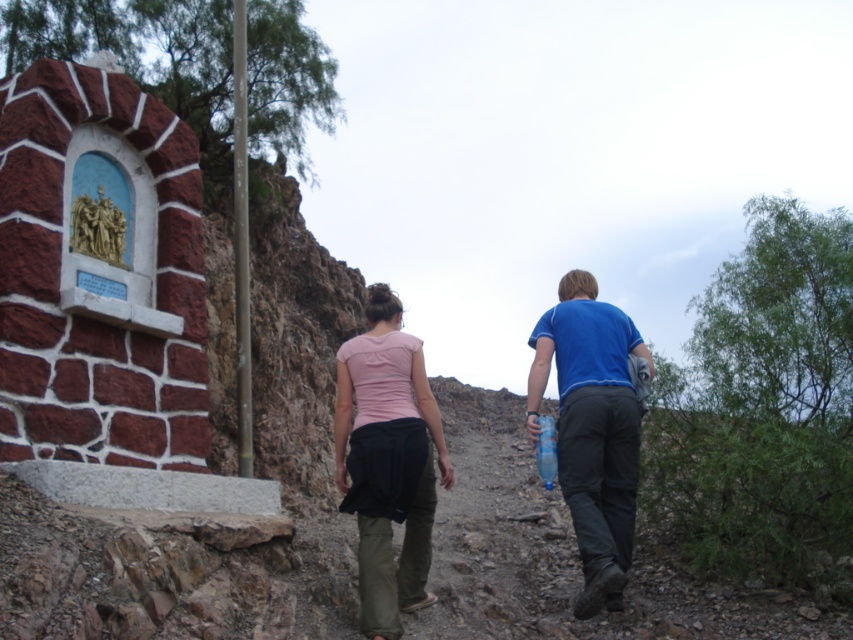
You are a photographer trying to capture a photo of the pink fabric shirt at center. You are standing at point [592,428]. Can you take the photo without moving from your current position?

Yes, because the pink fabric shirt at center is located exactly at your current position at point [592,428].

You are a photographer trying to capture both the pink fabric skirt at center and the blue cotton shirt at center in the same frame. Based on their positions, which one should you adjust your camera angle to focus on first to ensure both are in the shot?

The pink fabric skirt at center is to the left of the blue cotton shirt at center, so you should focus on the blue cotton shirt at center first to ensure the pink fabric skirt at center is also captured in the frame.

Looking at this image, what is the exact location of the pink fabric skirt at center in the image?

The pink fabric skirt at center is located at point (387, 460).